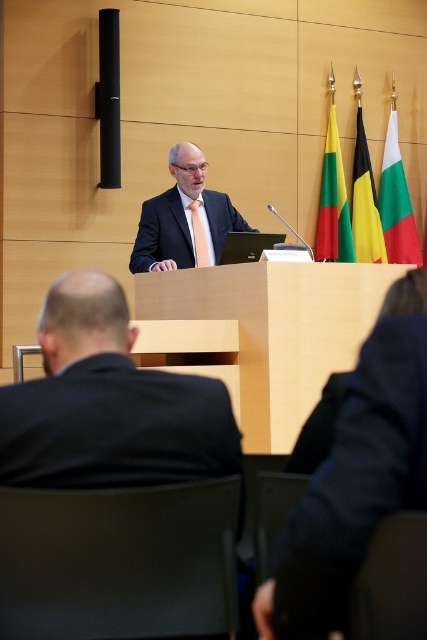
Is white fabric flag at right below yellow-green-black-yellow-green-black-yellow-green flag at upper center?

Indeed, white fabric flag at right is positioned under yellow-green-black-yellow-green-black-yellow-green flag at upper center.

Is white fabric flag at right above yellow-green-black-yellow-green-black-yellow-green flag at upper center?

Incorrect, white fabric flag at right is not positioned above yellow-green-black-yellow-green-black-yellow-green flag at upper center.

Which is behind, point (412, 214) or point (371, 176)?

The point (412, 214) is behind.

The width and height of the screenshot is (427, 640). I want to click on white fabric flag at right, so click(x=395, y=202).

Locate an element on the screen. The image size is (427, 640). black suit at lower left is located at coordinates (108, 403).

Based on the photo, who is more distant from viewer, [26,474] or [371,168]?

The point [371,168] is behind.

Where is `black suit at lower left`? Image resolution: width=427 pixels, height=640 pixels. black suit at lower left is located at coordinates (108, 403).

In the scene shown: Between yellow-green striped flag at center and matte black tie at center, which one is positioned lower?

matte black tie at center is lower down.

Is point (321, 253) farther from camera compared to point (198, 230)?

Yes, it is behind point (198, 230).

Who is more distant from viewer, (327, 212) or (204, 252)?

Point (327, 212)

In order to click on yellow-green striped flag at center in this screenshot , I will do `click(333, 202)`.